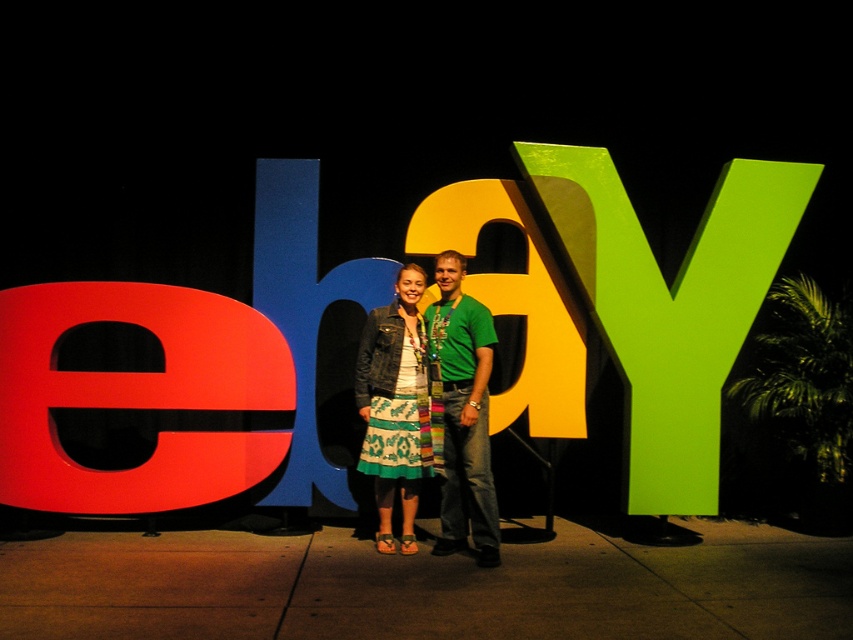
Can you confirm if matte yellow letter at center is thinner than denim jacket at center?

Incorrect, matte yellow letter at center's width is not less than denim jacket at center's.

Who is more distant from viewer, (x=527, y=246) or (x=404, y=291)?

Positioned behind is point (x=527, y=246).

What do you see at coordinates (514, 304) in the screenshot? I see `matte yellow letter at center` at bounding box center [514, 304].

Where is `matte yellow letter at center`? matte yellow letter at center is located at coordinates (514, 304).

Who is shorter, matte red letter e at left or matte yellow letter at center?

matte red letter e at left is shorter.

Is matte red letter e at left to the left of matte yellow letter at center from the viewer's perspective?

Indeed, matte red letter e at left is positioned on the left side of matte yellow letter at center.

Which is behind, point (4, 404) or point (485, 304)?

Positioned behind is point (485, 304).

Locate an element on the screen. Image resolution: width=853 pixels, height=640 pixels. matte red letter e at left is located at coordinates pos(138,396).

Between green textured shirt at center and matte yellow letter at center, which one is positioned lower?

Positioned lower is green textured shirt at center.

Where is `green textured shirt at center`? The width and height of the screenshot is (853, 640). green textured shirt at center is located at coordinates (428, 408).